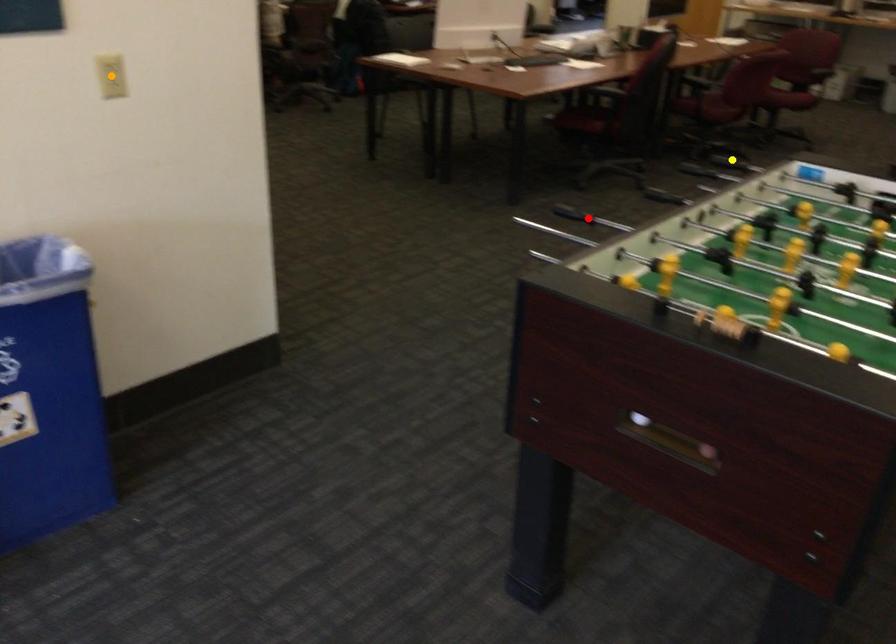
From the picture: Order these from nearest to farthest:
orange point, red point, yellow point

red point < orange point < yellow point